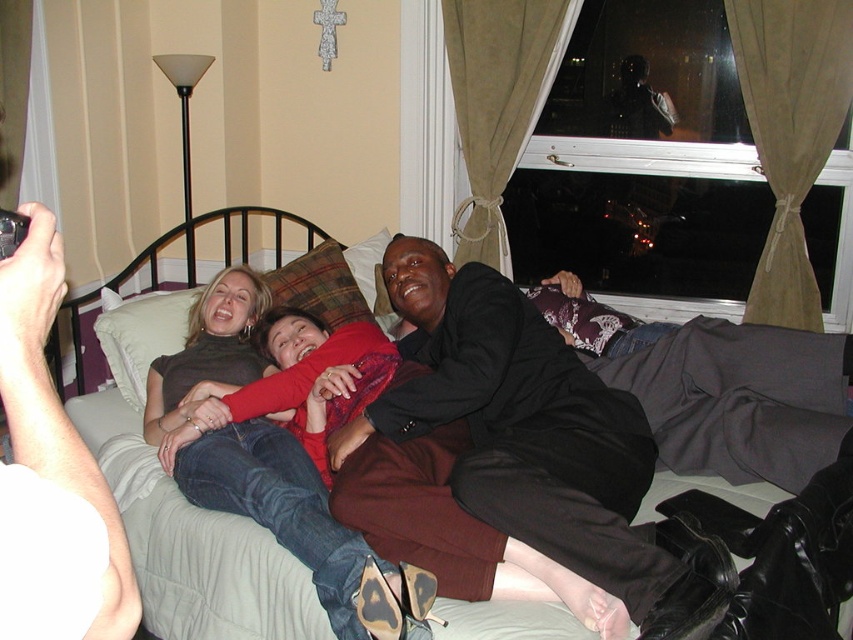
You are trying to find a place to put your dark brown leather jacket at center. Where should you put it so that it doesn not block the light gray fabric bed at center?

The light gray fabric bed at center is positioned on the left side of dark brown leather jacket at center, so you should place the dark brown leather jacket at center to the right of the light gray fabric bed at center to avoid blocking it.

You are a photographer setting up a shoot in the room. You need to place a 1.2 meter tall tripod between the light gray fabric bed at center and the plaid fabric pillow at center. Can the tripod fit vertically between them?

The light gray fabric bed at center is taller than the plaid fabric pillow at center. Since the tripod is 1.2 meters tall, it can only fit vertically between them if the space between the two objects is at least 1.2 meters. However, the description only states their relative heights, not the distance between them. Without knowing the distance, we cannot confirm if the tripod will fit.

You are standing at the origin of the coordinate system in the room. You want to move towards the bed. Is the point at coordinate (740, 397) located on the bed?

Yes, the point at coordinate (740, 397) is located on the light gray fabric bed at center.